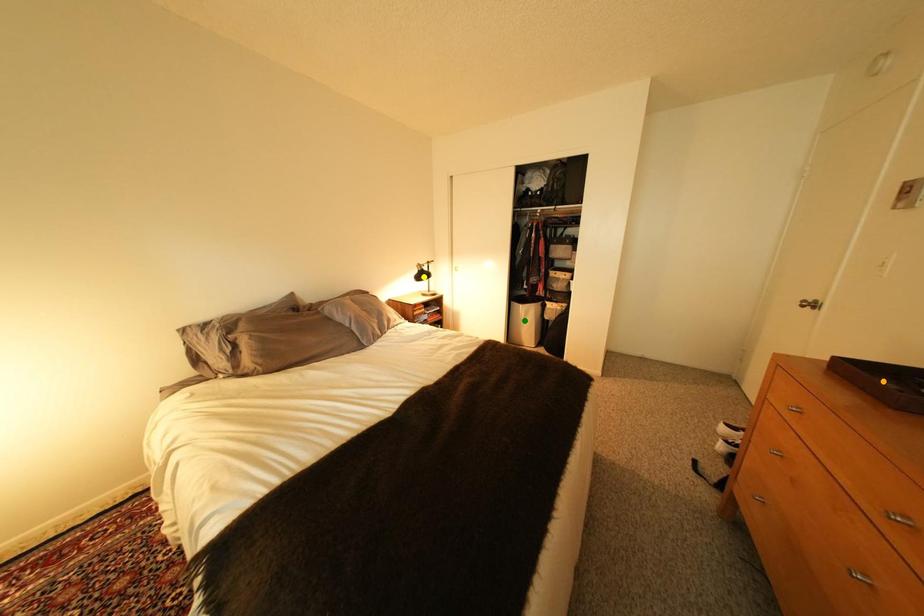
Consider the image. Order these from nearest to farthest:
yellow point | green point | orange point

orange point < yellow point < green point